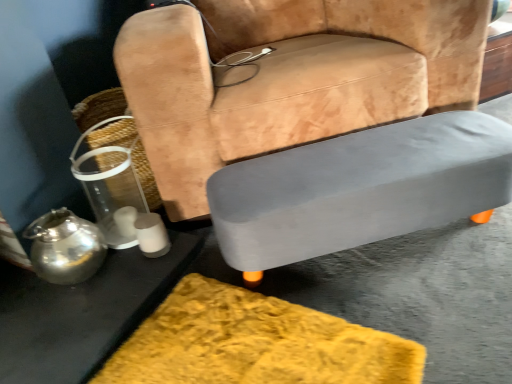
Image resolution: width=512 pixels, height=384 pixels. Identify the location of vacant area on top of gray matte table at lower right, the 1th table when ordered from right to left (from a real-world perspective). (362, 158).